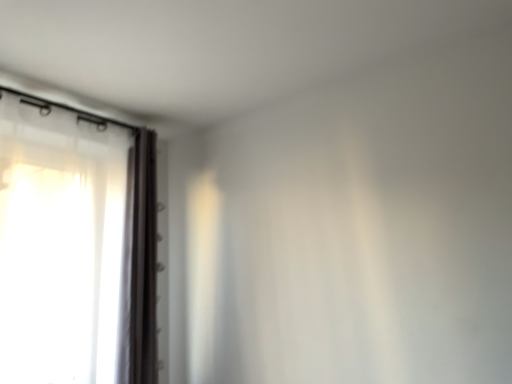
Question: Does white sheer curtain at left, marked as the second curtain in a left-to-right arrangement, have a lesser height compared to white sheer curtain at left, the 2th curtain when ordered from right to left?

Choices:
 (A) no
 (B) yes

Answer: (B)

Question: Are white sheer curtain at left, the first curtain in the right-to-left sequence, and white sheer curtain at left, the first curtain viewed from the left, far apart?

Choices:
 (A) yes
 (B) no

Answer: (B)

Question: Can you confirm if white sheer curtain at left, the first curtain in the right-to-left sequence, is positioned to the right of white sheer curtain at left, the 2th curtain when ordered from right to left?

Choices:
 (A) yes
 (B) no

Answer: (A)

Question: Is white sheer curtain at left, marked as the second curtain in a left-to-right arrangement, looking in the opposite direction of white sheer curtain at left, the first curtain viewed from the left?

Choices:
 (A) yes
 (B) no

Answer: (A)

Question: Is white sheer curtain at left, the first curtain in the right-to-left sequence, at the left side of white sheer curtain at left, the first curtain viewed from the left?

Choices:
 (A) no
 (B) yes

Answer: (A)

Question: Is white sheer curtain at left, marked as the second curtain in a left-to-right arrangement, located outside white sheer curtain at left, the 2th curtain when ordered from right to left?

Choices:
 (A) yes
 (B) no

Answer: (A)

Question: Considering the relative positions of white sheer curtain at left, the first curtain viewed from the left, and white sheer curtain at left, the first curtain in the right-to-left sequence, in the image provided, is white sheer curtain at left, the first curtain viewed from the left, to the left of white sheer curtain at left, the first curtain in the right-to-left sequence, from the viewer's perspective?

Choices:
 (A) yes
 (B) no

Answer: (A)

Question: Is white sheer curtain at left, the first curtain viewed from the left, oriented towards white sheer curtain at left, marked as the second curtain in a left-to-right arrangement?

Choices:
 (A) yes
 (B) no

Answer: (A)

Question: From a real-world perspective, does white sheer curtain at left, the 2th curtain when ordered from right to left, stand above white sheer curtain at left, marked as the second curtain in a left-to-right arrangement?

Choices:
 (A) no
 (B) yes

Answer: (B)

Question: Is white sheer curtain at left, the 2th curtain when ordered from right to left, looking in the opposite direction of white sheer curtain at left, the first curtain in the right-to-left sequence?

Choices:
 (A) no
 (B) yes

Answer: (A)

Question: Is white sheer curtain at left, the 2th curtain when ordered from right to left, with white sheer curtain at left, the first curtain in the right-to-left sequence?

Choices:
 (A) yes
 (B) no

Answer: (B)

Question: Does white sheer curtain at left, the first curtain viewed from the left, have a greater width compared to white sheer curtain at left, the first curtain in the right-to-left sequence?

Choices:
 (A) no
 (B) yes

Answer: (B)

Question: Is white sheer curtain at left, marked as the second curtain in a left-to-right arrangement, wider or thinner than white sheer curtain at left, the first curtain viewed from the left?

Choices:
 (A) thin
 (B) wide

Answer: (A)